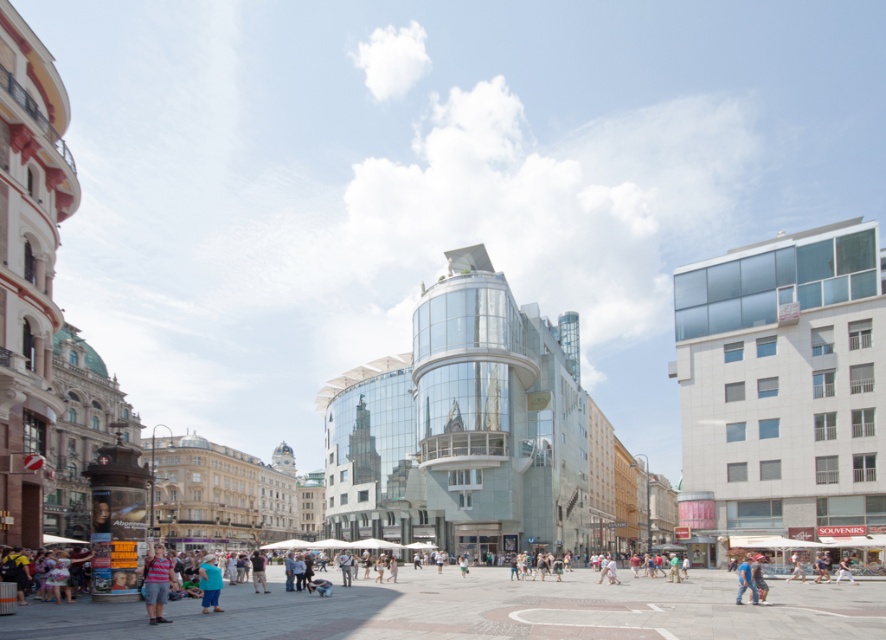
Question: Which point appears closest to the camera in this image?

Choices:
 (A) (739, 598)
 (B) (154, 548)

Answer: (B)

Question: Observing the image, what is the correct spatial positioning of striped cotton shirt at lower center in reference to blue fabric pants at lower left?

Choices:
 (A) below
 (B) above

Answer: (B)

Question: Is the position of striped cotton shirt at lower center less distant than that of blue denim jeans at center?

Choices:
 (A) yes
 (B) no

Answer: (A)

Question: Which of the following is the closest to the observer?

Choices:
 (A) blue denim jeans at center
 (B) blue fabric pants at lower left
 (C) striped cotton shirt at lower center

Answer: (C)

Question: Can you confirm if striped cotton shirt at lower center is positioned to the left of blue fabric pants at lower left?

Choices:
 (A) no
 (B) yes

Answer: (A)

Question: Estimate the real-world distances between objects in this image. Which object is closer to the blue denim jeans at center?

Choices:
 (A) blue fabric pants at lower left
 (B) striped cotton shirt at lower center

Answer: (A)